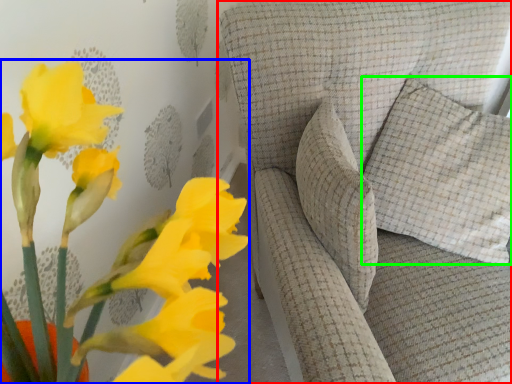
Question: Considering the real-world distances, which object is closest to furniture (highlighted by a red box)? floral arrangement (highlighted by a blue box) or pillow (highlighted by a green box).

Choices:
 (A) floral arrangement
 (B) pillow

Answer: (B)